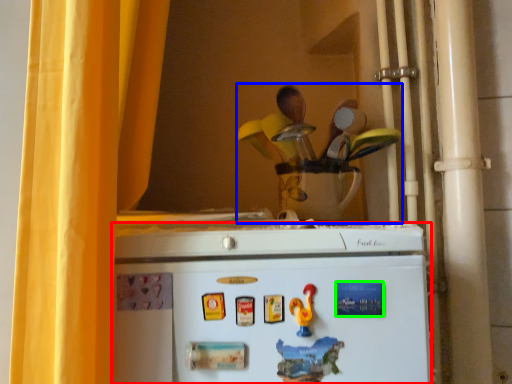
Question: Based on their relative distances, which object is farther from refrigerator (highlighted by a red box)? Choose from toy (highlighted by a blue box) and magnet (highlighted by a green box).

Choices:
 (A) toy
 (B) magnet

Answer: (A)